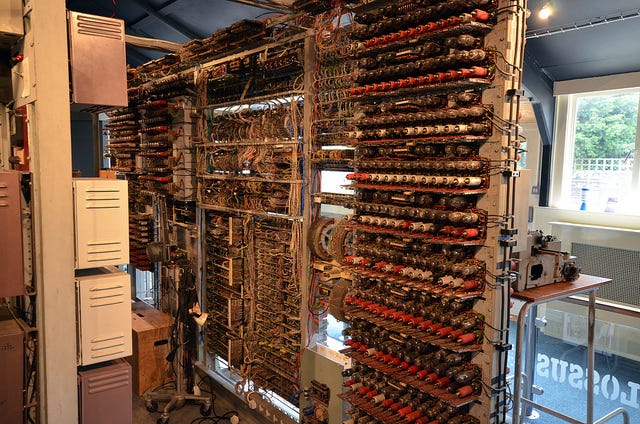
At what (x,y) coordinates should I click in order to perform the action: click on floor. Please return your answer as a coordinate pair (x, y). Image resolution: width=640 pixels, height=424 pixels. Looking at the image, I should click on (148, 417).